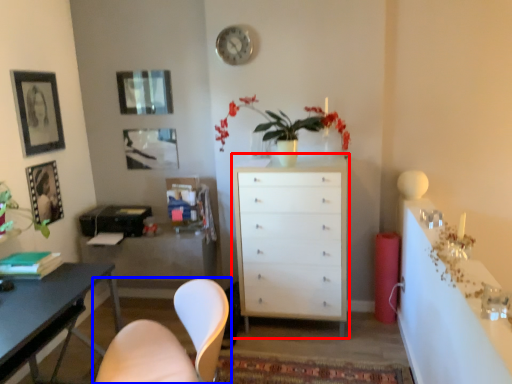
Question: Which object is further to the camera taking this photo, chest of drawers (highlighted by a red box) or chair (highlighted by a blue box)?

Choices:
 (A) chest of drawers
 (B) chair

Answer: (A)